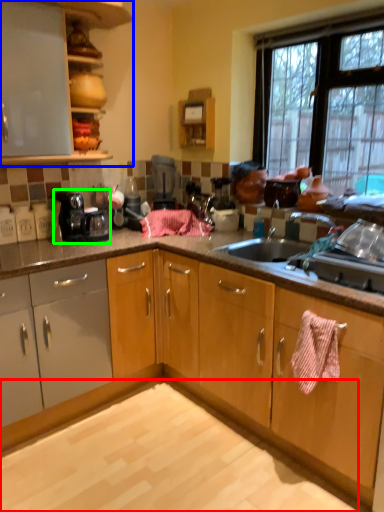
Question: Considering the real-world distances, which object is closest to granite (highlighted by a red box)? cabinetry (highlighted by a blue box) or home appliance (highlighted by a green box).

Choices:
 (A) cabinetry
 (B) home appliance

Answer: (B)